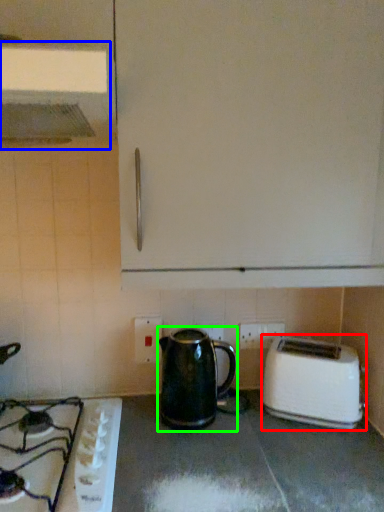
Question: Based on their relative distances, which object is farther from toaster (highlighted by a red box)? Choose from exhaust hood (highlighted by a blue box) and kettle (highlighted by a green box).

Choices:
 (A) exhaust hood
 (B) kettle

Answer: (A)